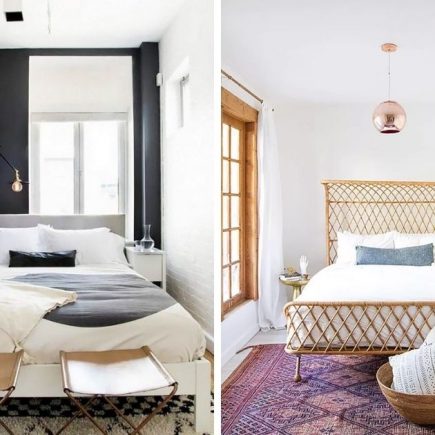
Locate an element on the screen. tv tray front of bed is located at coordinates (118, 368), (12, 363).